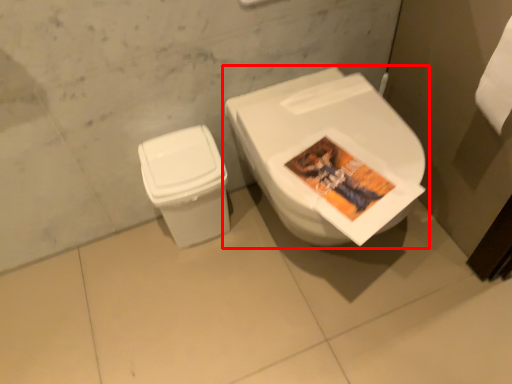
Question: From the image's perspective, where is toilet (annotated by the red box) located relative to toilet bowl?

Choices:
 (A) above
 (B) below

Answer: (A)